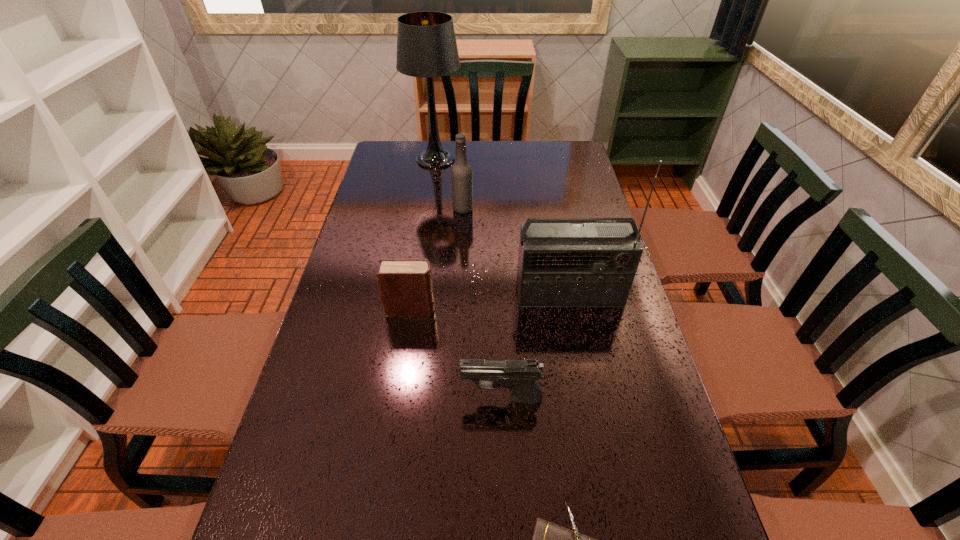
Locate an element on the screen. This screenshot has height=540, width=960. vacant space at the far edge is located at coordinates (523, 151).

At what (x,y) coordinates should I click in order to perform the action: click on vacant space at the left edge of the desktop. Please return your answer as a coordinate pair (x, y). The height and width of the screenshot is (540, 960). Looking at the image, I should click on (300, 402).

Find the location of `free space at the right edge of the desktop`. free space at the right edge of the desktop is located at coordinates (579, 180).

The image size is (960, 540). Identify the location of free area in between the beer bottle and the radio receiver. (516, 251).

You are a GUI agent. You are given a task and a screenshot of the screen. Output one action in this format:
    pyautogui.click(x=<x>, y=<y>)
    Task: Click on the free point between the fifth shortest object and the farthest object
    This screenshot has height=540, width=960.
    Given the screenshot: What is the action you would take?
    pyautogui.click(x=502, y=227)

Find the location of a particular element. vacant region between the third tallest object and the taller diary is located at coordinates (437, 259).

What are the coordinates of `free spot between the fifth tallest object and the beer bottle` in the screenshot? It's located at (482, 303).

Where is `blank region between the left diary and the fourth shortest object`? The height and width of the screenshot is (540, 960). blank region between the left diary and the fourth shortest object is located at coordinates (437, 259).

Find the location of a particular element. The height and width of the screenshot is (540, 960). empty space between the farthest object and the radio receiver is located at coordinates (502, 227).

Identify the location of object that is the fifth closest to the nearest object. (426, 44).